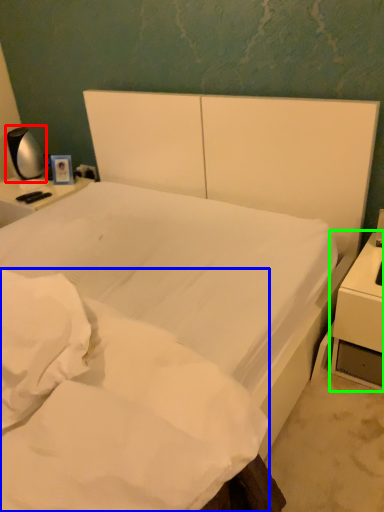
Question: Which is farther away from bedside lamp (highlighted by a red box)? mattress (highlighted by a blue box) or nightstand (highlighted by a green box)?

Choices:
 (A) mattress
 (B) nightstand

Answer: (B)